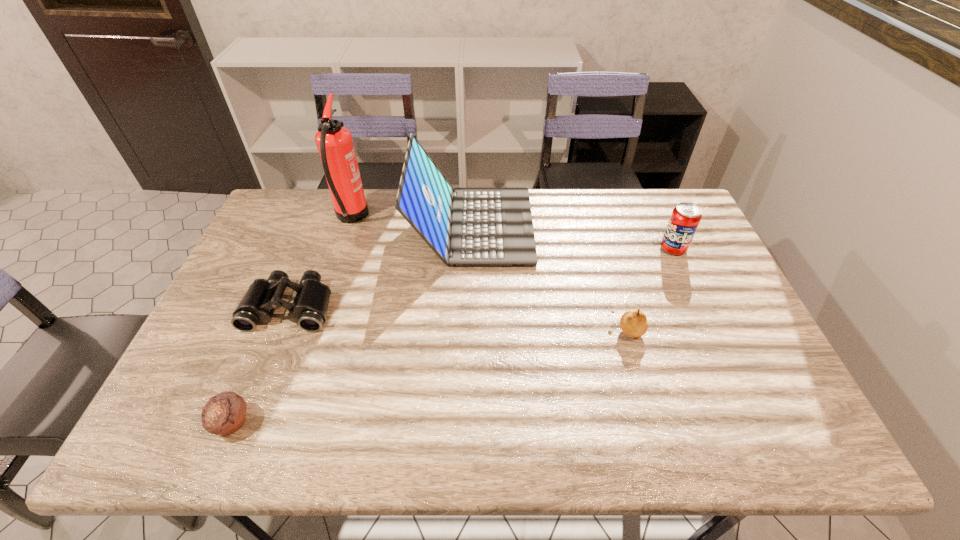
At what (x,y) coordinates should I click in order to perform the action: click on object that is at the near left corner. Please return your answer as a coordinate pair (x, y). Looking at the image, I should click on (225, 413).

Where is `free space at the far edge of the desktop`? This screenshot has width=960, height=540. free space at the far edge of the desktop is located at coordinates (384, 229).

At what (x,y) coordinates should I click in order to perform the action: click on vacant space at the near edge of the desktop. Please return your answer as a coordinate pair (x, y). The image size is (960, 540). Looking at the image, I should click on (676, 415).

This screenshot has width=960, height=540. In order to click on free space at the left edge of the desktop in this screenshot , I will do `click(232, 376)`.

Image resolution: width=960 pixels, height=540 pixels. In the image, there is a desktop. In order to click on vacant space at the right edge in this screenshot , I will do `click(718, 383)`.

In the image, there is a desktop. Where is `vacant space at the far left corner`? Image resolution: width=960 pixels, height=540 pixels. vacant space at the far left corner is located at coordinates click(271, 218).

Find the location of a particular element. This screenshot has height=540, width=960. blank space at the far right corner is located at coordinates (671, 192).

Where is `empty location between the third tallest object and the pear`? The width and height of the screenshot is (960, 540). empty location between the third tallest object and the pear is located at coordinates (650, 289).

The height and width of the screenshot is (540, 960). In order to click on free space between the second object from right to left and the fourth object from left to right in this screenshot , I will do `click(550, 278)`.

Locate an element on the screen. The width and height of the screenshot is (960, 540). free space that is in between the pear and the muffin is located at coordinates point(430,376).